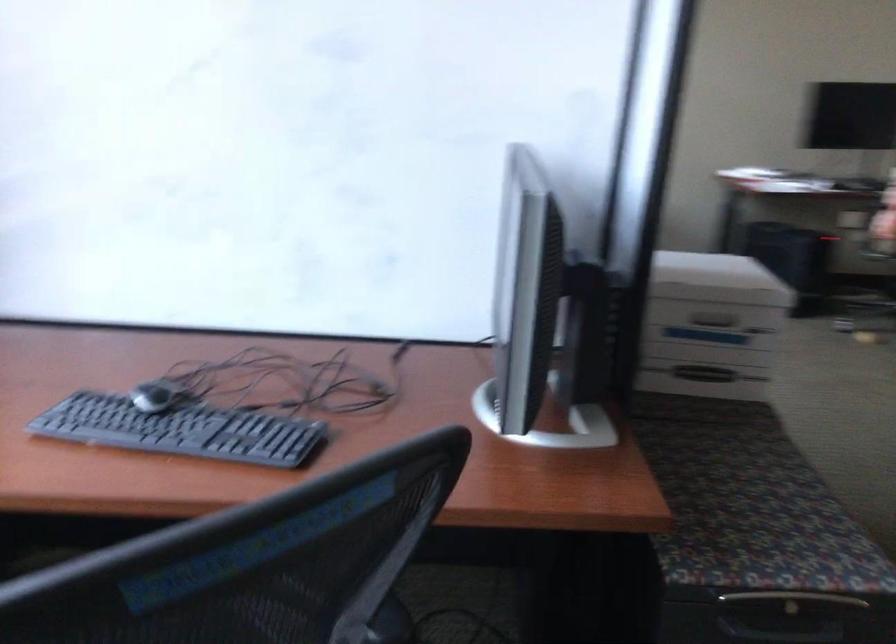
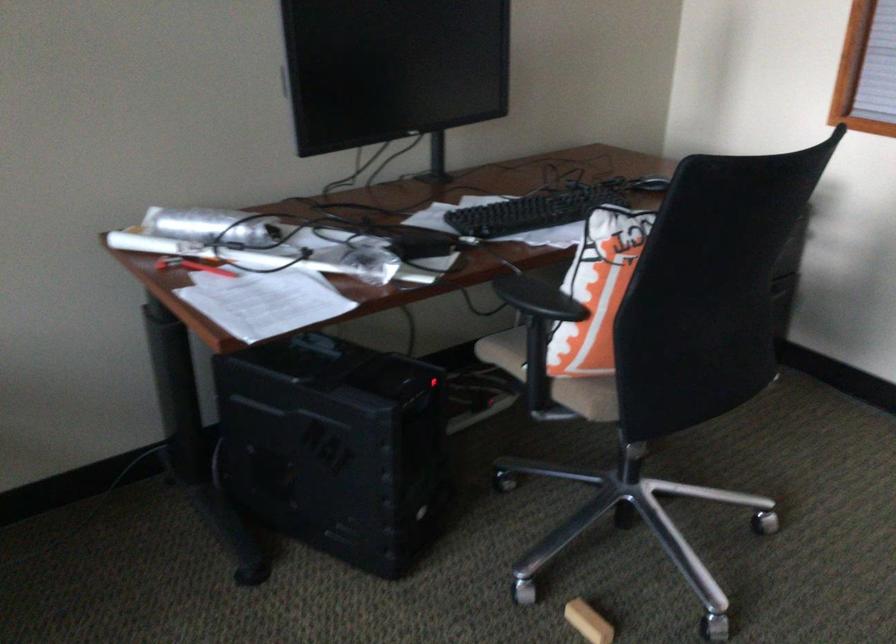
Locate, in the second image, the point that corresponds to point 785,152 in the first image.

(192, 266)